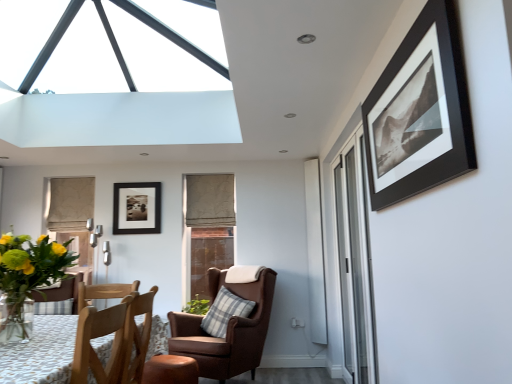
Question: Can you confirm if beige fabric curtain at center is wider than transparent glass window at upper center, the 1th window from the front?

Choices:
 (A) no
 (B) yes

Answer: (A)

Question: Can you confirm if beige fabric curtain at center is thinner than transparent glass window at upper center, placed as the second window when sorted from bottom to top?

Choices:
 (A) no
 (B) yes

Answer: (B)

Question: Is beige fabric curtain at center smaller than transparent glass window at upper center, the 1th window from the front?

Choices:
 (A) no
 (B) yes

Answer: (B)

Question: Is beige fabric curtain at center far from transparent glass window at upper center, the first window from the top?

Choices:
 (A) yes
 (B) no

Answer: (A)

Question: Is the depth of beige fabric curtain at center greater than that of transparent glass window at upper center, the 1th window from the front?

Choices:
 (A) no
 (B) yes

Answer: (B)

Question: Is beige fabric curtain at center taller than transparent glass window at upper center, placed as the second window when sorted from bottom to top?

Choices:
 (A) yes
 (B) no

Answer: (A)

Question: Does matte black picture frame at center, acting as the second picture frame starting from the right, come in front of leather wingback chair with plaid pillow at center, which is counted as the second chair, starting from the front?

Choices:
 (A) no
 (B) yes

Answer: (A)

Question: Considering the relative sizes of matte black picture frame at center, positioned as the first picture frame in left-to-right order, and leather wingback chair with plaid pillow at center, arranged as the 1th chair when viewed from the back, in the image provided, is matte black picture frame at center, positioned as the first picture frame in left-to-right order, bigger than leather wingback chair with plaid pillow at center, arranged as the 1th chair when viewed from the back,?

Choices:
 (A) no
 (B) yes

Answer: (A)

Question: Does matte black picture frame at center, the first picture frame when ordered from back to front, have a lesser width compared to leather wingback chair with plaid pillow at center, which is counted as the second chair, starting from the front?

Choices:
 (A) yes
 (B) no

Answer: (A)

Question: Is matte black picture frame at center, placed as the 2th picture frame when sorted from front to back, wider than leather wingback chair with plaid pillow at center, which is counted as the second chair, starting from the front?

Choices:
 (A) no
 (B) yes

Answer: (A)

Question: Is matte black picture frame at center, placed as the 2th picture frame when sorted from front to back, taller than leather wingback chair with plaid pillow at center, which is counted as the second chair, starting from the front?

Choices:
 (A) no
 (B) yes

Answer: (A)

Question: Is leather wingback chair with plaid pillow at center, arranged as the 1th chair when viewed from the back, surrounded by matte black picture frame at center, positioned as the first picture frame in left-to-right order?

Choices:
 (A) no
 (B) yes

Answer: (A)

Question: Does wooden chair at lower left, which ranks as the 1th chair in front-to-back order, turn towards green leafy plant at lower left?

Choices:
 (A) yes
 (B) no

Answer: (B)